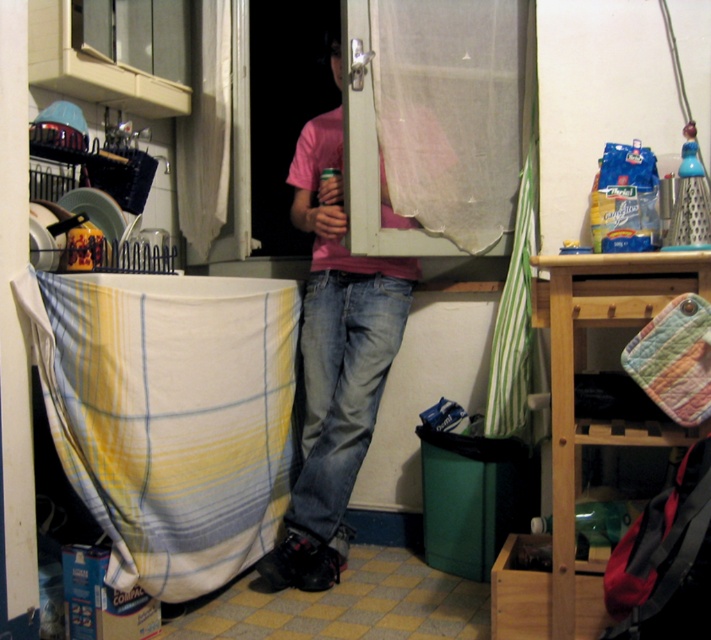
You are standing in the kitchen and want to reach the matte plastic screen door at center. Is the pink cotton shirt at center blocking your path to it?

The pink cotton shirt at center is closer to the viewer than the matte plastic screen door at center, so the pink cotton shirt at center is blocking the path to the matte plastic screen door at center.

You are trying to determine if the pink cotton shirt at center will fit through the space above the matte plastic screen door at center. Can it pass through vertically?

The pink cotton shirt at center is taller than the matte plastic screen door at center, so it cannot pass through vertically.

You are standing in the kitchen and want to reach the point marked by the coordinates (333, 362). What object is located at that point?

The point at coordinates (333, 362) corresponds to the pink cotton shirt at center.